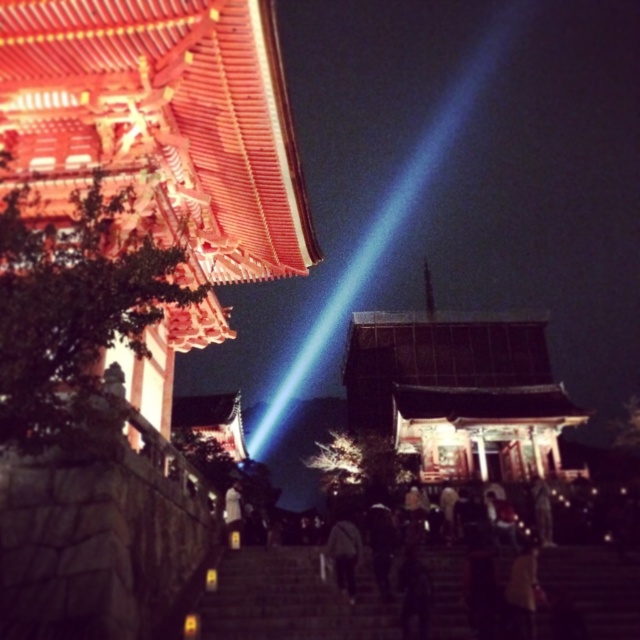
Is dark stone stairs at center further to camera compared to white matte person at center?

No, dark stone stairs at center is in front of white matte person at center.

Can you confirm if dark stone stairs at center is positioned to the right of white matte person at center?

Yes, dark stone stairs at center is to the right of white matte person at center.

Identify the location of dark stone stairs at center. (291, 600).

Identify the location of dark stone stairs at center. (291, 600).

Who is shorter, dark gray fabric jacket at center or white matte person at center?

Standing shorter between the two is white matte person at center.

You are a GUI agent. You are given a task and a screenshot of the screen. Output one action in this format:
    pyautogui.click(x=<x>, y=<y>)
    Task: Click on the dark gray fabric jacket at center
    
    Given the screenshot: What is the action you would take?
    pyautogui.click(x=344, y=552)

What do you see at coordinates (291, 600) in the screenshot?
I see `dark stone stairs at center` at bounding box center [291, 600].

Between dark stone stairs at center and dark gray fabric jacket at center, which one is positioned higher?

dark stone stairs at center is above.

This screenshot has height=640, width=640. Describe the element at coordinates (291, 600) in the screenshot. I see `dark stone stairs at center` at that location.

You are a GUI agent. You are given a task and a screenshot of the screen. Output one action in this format:
    pyautogui.click(x=<x>, y=<y>)
    Task: Click on the dark stone stairs at center
    This screenshot has width=640, height=640.
    Given the screenshot: What is the action you would take?
    pyautogui.click(x=291, y=600)